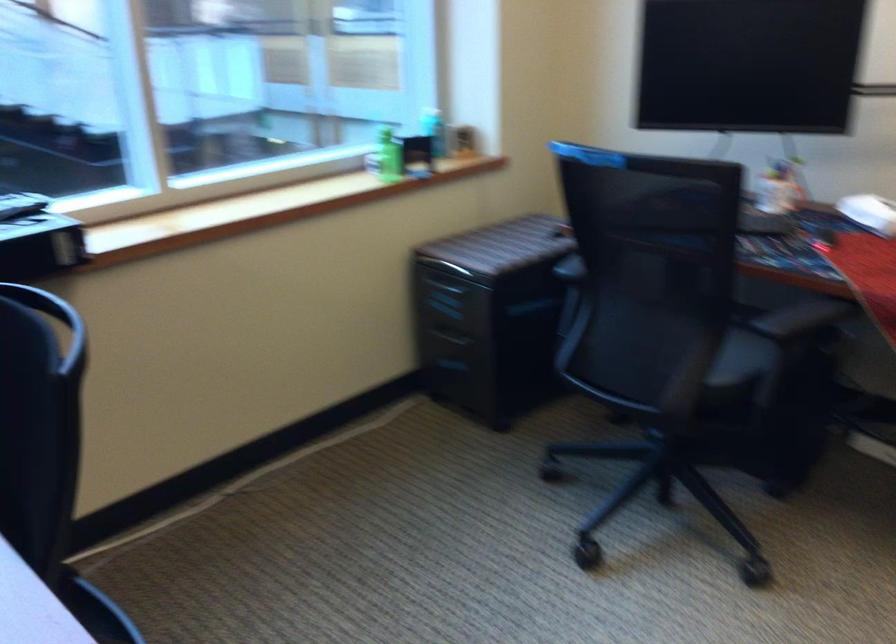
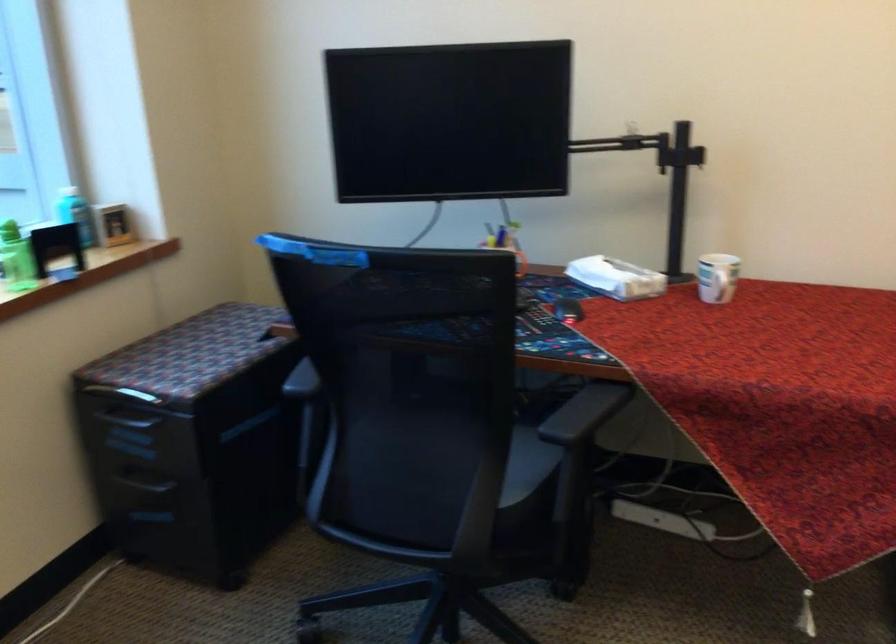
In the second image, find the point that corresponds to [426,128] in the first image.

(74, 214)